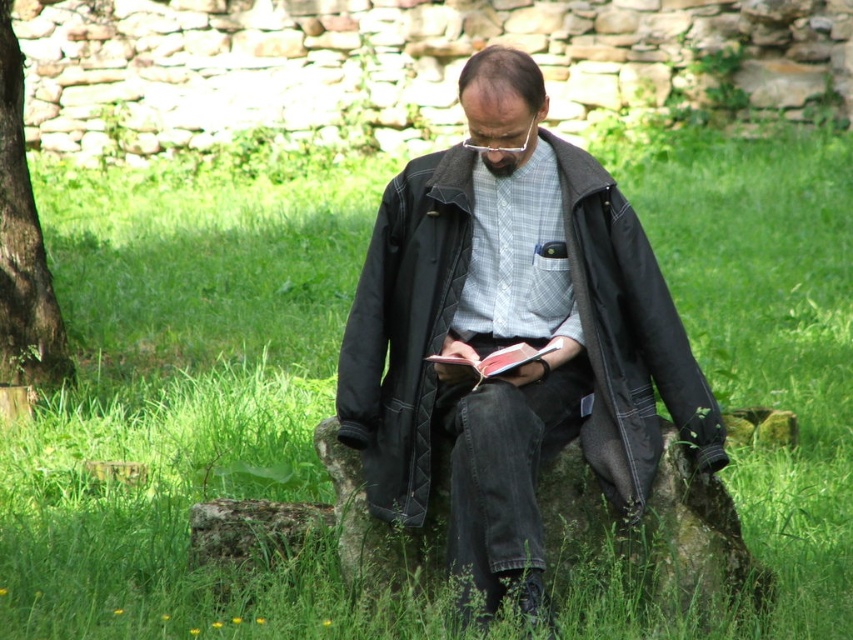
Which is in front, point (543, 288) or point (538, 349)?

Point (538, 349) is in front.

Is point (659, 305) closer to viewer compared to point (527, 355)?

No, it is behind (527, 355).

Where is `matte black jacket at center`? matte black jacket at center is located at coordinates (511, 333).

Measure the distance from dark brown bark at left to red leather book at center.

A distance of 5.37 meters exists between dark brown bark at left and red leather book at center.

Is dark brown bark at left further to camera compared to red leather book at center?

That is True.

You are a GUI agent. You are given a task and a screenshot of the screen. Output one action in this format:
    pyautogui.click(x=<x>, y=<y>)
    Task: Click on the dark brown bark at left
    
    Given the screenshot: What is the action you would take?
    pyautogui.click(x=22, y=244)

Does matte black jacket at center appear on the right side of dark brown bark at left?

Indeed, matte black jacket at center is positioned on the right side of dark brown bark at left.

Is matte black jacket at center smaller than dark brown bark at left?

Actually, matte black jacket at center might be larger than dark brown bark at left.

Find the location of a particular element. Image resolution: width=853 pixels, height=640 pixels. matte black jacket at center is located at coordinates (511, 333).